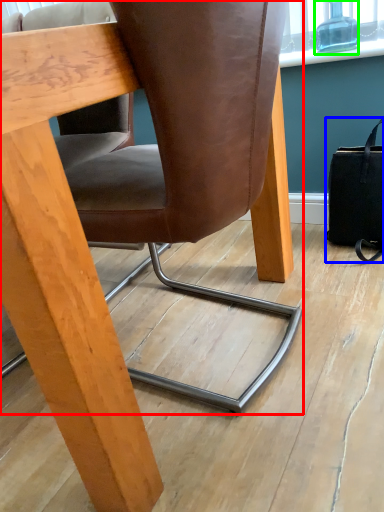
Question: Which object is positioned closest to chair (highlighted by a red box)? Select from handbag (highlighted by a blue box) and bottle (highlighted by a green box).

Choices:
 (A) handbag
 (B) bottle

Answer: (A)